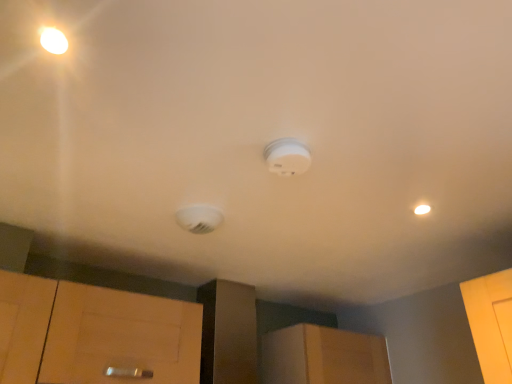
Describe the element at coordinates (323, 357) in the screenshot. I see `wooden cabinet at center` at that location.

Identify the location of wooden cabinet at center. The height and width of the screenshot is (384, 512). (323, 357).

In order to face white plastic smoke detector at center, should I rotate leftwards or rightwards?

You should look left and rotate roughly 7.697 degrees.

This screenshot has width=512, height=384. Describe the element at coordinates (199, 218) in the screenshot. I see `white plastic smoke detector at center` at that location.

I want to click on white plastic smoke detector at center, so click(199, 218).

What is the approximate height of white plastic smoke detector at center?

It is 2.17 inches.

Identify the location of wooden cabinet at center. This screenshot has height=384, width=512. 323,357.

Considering the positions of objects wooden cabinet at center and white plastic smoke detector at center in the image provided, who is more to the right, wooden cabinet at center or white plastic smoke detector at center?

Positioned to the right is wooden cabinet at center.

Is wooden cabinet at center in front of or behind white plastic smoke detector at center in the image?

wooden cabinet at center is positioned farther from the viewer than white plastic smoke detector at center.

Considering the points (365, 370) and (189, 214), which point is in front, point (365, 370) or point (189, 214)?

The point (189, 214) is more forward.

From the image's perspective, which is above, wooden cabinet at center or white plastic smoke detector at center?

From the image's view, white plastic smoke detector at center is above.

From a real-world perspective, which is physically above, wooden cabinet at center or white plastic smoke detector at center?

From a 3D spatial view, white plastic smoke detector at center is above.

In the scene shown: In terms of width, does wooden cabinet at center look wider or thinner when compared to white plastic smoke detector at center?

Clearly, wooden cabinet at center has more width compared to white plastic smoke detector at center.

Who is shorter, wooden cabinet at center or white plastic smoke detector at center?

white plastic smoke detector at center is shorter.

Looking at this image, between wooden cabinet at center and white plastic smoke detector at center, which one has smaller size?

white plastic smoke detector at center is smaller.

Would you say wooden cabinet at center is inside or outside white plastic smoke detector at center?

wooden cabinet at center is spatially situated outside white plastic smoke detector at center.

Is wooden cabinet at center beside white plastic smoke detector at center?

No, wooden cabinet at center is not with white plastic smoke detector at center.

Is wooden cabinet at center facing away from white plastic smoke detector at center?

wooden cabinet at center does not have its back to white plastic smoke detector at center.

Measure the distance between wooden cabinet at center and white plastic smoke detector at center.

wooden cabinet at center is 3.58 feet away from white plastic smoke detector at center.

You are a GUI agent. You are given a task and a screenshot of the screen. Output one action in this format:
    pyautogui.click(x=<x>, y=<y>)
    Task: Click on the cabinetry behind the white plastic smoke detector at center
    Image resolution: width=512 pixels, height=384 pixels.
    Given the screenshot: What is the action you would take?
    pyautogui.click(x=323, y=357)

Is white plastic smoke detector at center at the right side of wooden cabinet at center?

Incorrect, white plastic smoke detector at center is not on the right side of wooden cabinet at center.

Considering the positions of objects white plastic smoke detector at center and wooden cabinet at center in the image provided, who is in front, white plastic smoke detector at center or wooden cabinet at center?

white plastic smoke detector at center.

Is point (187, 222) positioned after point (374, 352)?

No, (187, 222) is in front of (374, 352).

From the image's perspective, who appears lower, white plastic smoke detector at center or wooden cabinet at center?

wooden cabinet at center is shown below in the image.

From a real-world perspective, which object rests below the other?

wooden cabinet at center is physically lower.

Can you confirm if white plastic smoke detector at center is thinner than wooden cabinet at center?

Yes.

Which of these two, white plastic smoke detector at center or wooden cabinet at center, stands taller?

wooden cabinet at center.

Considering the sizes of objects white plastic smoke detector at center and wooden cabinet at center in the image provided, who is bigger, white plastic smoke detector at center or wooden cabinet at center?

Bigger between the two is wooden cabinet at center.

Would you say wooden cabinet at center is part of white plastic smoke detector at center's contents?

Actually, wooden cabinet at center is outside white plastic smoke detector at center.

Are white plastic smoke detector at center and wooden cabinet at center far apart?

Yes.

Is white plastic smoke detector at center looking in the opposite direction of wooden cabinet at center?

No, white plastic smoke detector at center is not facing away from wooden cabinet at center.

Can you tell me how much white plastic smoke detector at center and wooden cabinet at center differ in facing direction?

0.00182 degrees separate the facing orientations of white plastic smoke detector at center and wooden cabinet at center.

Measure the distance between white plastic smoke detector at center and wooden cabinet at center.

white plastic smoke detector at center is 1.09 meters from wooden cabinet at center.

At what (x,y) coordinates should I click in order to perform the action: click on cabinetry on the right of white plastic smoke detector at center. Please return your answer as a coordinate pair (x, y). Looking at the image, I should click on (323, 357).

Where is `cabinetry below the white plastic smoke detector at center (from a real-world perspective)`? Image resolution: width=512 pixels, height=384 pixels. cabinetry below the white plastic smoke detector at center (from a real-world perspective) is located at coordinates (323, 357).

Locate an element on the screen. This screenshot has height=384, width=512. lamp above the wooden cabinet at center (from a real-world perspective) is located at coordinates (199, 218).